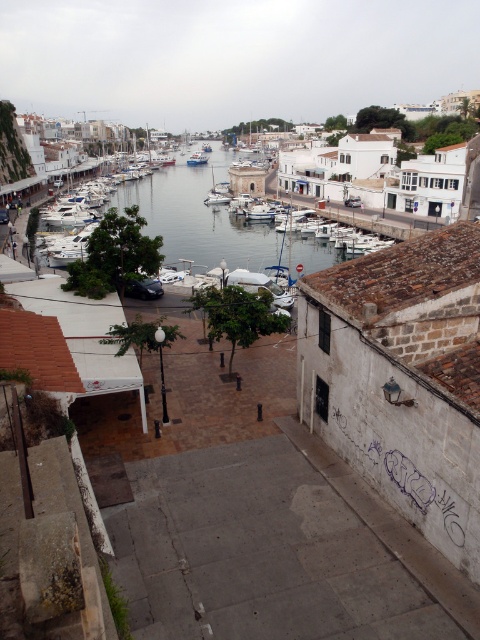
Question: Can you confirm if white matte boat at center is positioned to the right of white glossy boat at center?

Choices:
 (A) no
 (B) yes

Answer: (B)

Question: Among these points, which one is farthest from the camera?

Choices:
 (A) (199, 150)
 (B) (262, 209)

Answer: (A)

Question: Can you confirm if white matte boat at center is positioned below white glossy boat at center?

Choices:
 (A) no
 (B) yes

Answer: (B)

Question: Which of the following is the farthest from the observer?

Choices:
 (A) (262, 209)
 (B) (202, 163)

Answer: (B)

Question: In this image, where is white matte boat at center located relative to white glossy boat at center?

Choices:
 (A) right
 (B) left

Answer: (A)

Question: Which of the following is the closest to the observer?

Choices:
 (A) (189, 164)
 (B) (262, 218)

Answer: (B)